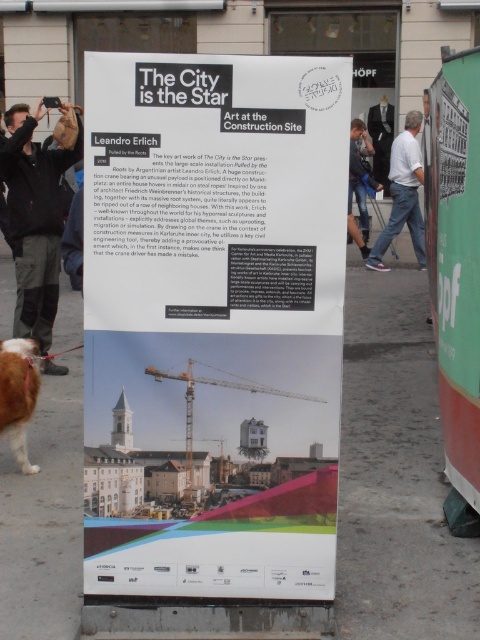
Question: Is green matte poster at right in front of black jacket at left?

Choices:
 (A) no
 (B) yes

Answer: (B)

Question: Does white paper poster at center lie behind black jacket at left?

Choices:
 (A) yes
 (B) no

Answer: (B)

Question: Considering the relative positions of white paper poster at center and green matte poster at right in the image provided, where is white paper poster at center located with respect to green matte poster at right?

Choices:
 (A) below
 (B) above

Answer: (A)

Question: Based on their relative distances, which object is farther from the green matte poster at right?

Choices:
 (A) white paper poster at center
 (B) black jacket at left

Answer: (B)

Question: Which of the following is the farthest from the observer?

Choices:
 (A) white cotton shirt at upper right
 (B) black jacket at left

Answer: (A)

Question: Estimate the real-world distances between objects in this image. Which object is farther from the white paper poster at center?

Choices:
 (A) white cotton shirt at upper right
 (B) black jacket at left
 (C) denim jeans at center

Answer: (A)